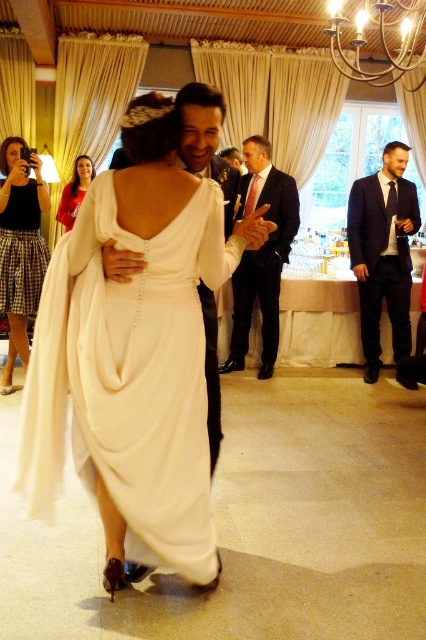
You are a photographer at the wedding reception. You need to capture a photo that includes both the plaid skirt at lower left and the matte red dress at upper left. Which one of these two items appears narrower in the photo?

The plaid skirt at lower left appears narrower in the photo because it has a lesser width compared to the matte red dress at upper left.